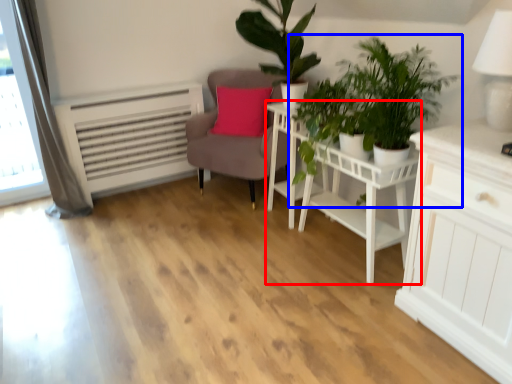
Question: Which object appears farthest to the camera in this image, table (highlighted by a red box) or houseplant (highlighted by a blue box)?

Choices:
 (A) table
 (B) houseplant

Answer: (A)